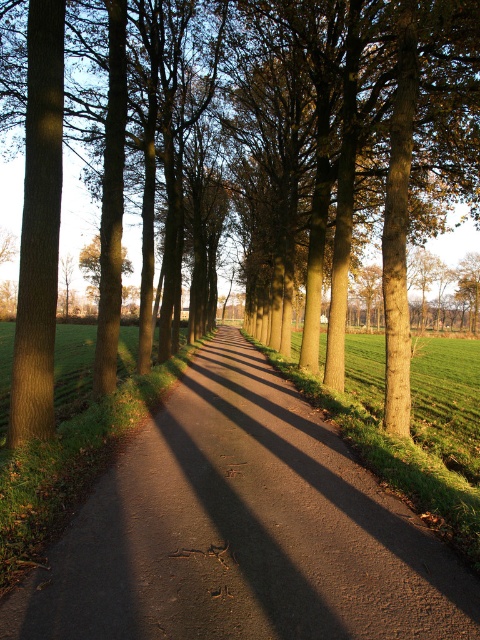
You are a hiker trying to determine the best spot to rest along the dirt path. Given the presence of the brown textured tree at center and the dark brown asphalt at center, which object would provide more shade based on their sizes?

The brown textured tree at center is larger in size than the dark brown asphalt at center, so the tree would provide more shade.